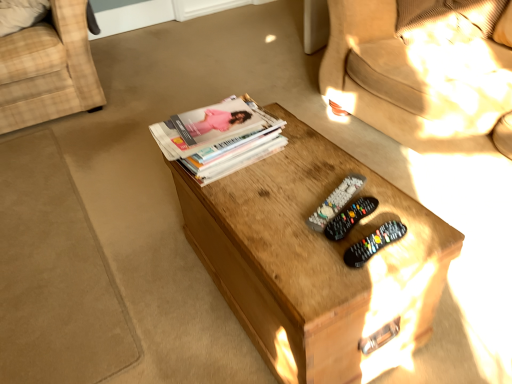
The width and height of the screenshot is (512, 384). In order to click on free space to the left of black plastic remote controls at center, which ranks as the first remote control in front-to-back order in this screenshot , I will do `click(298, 253)`.